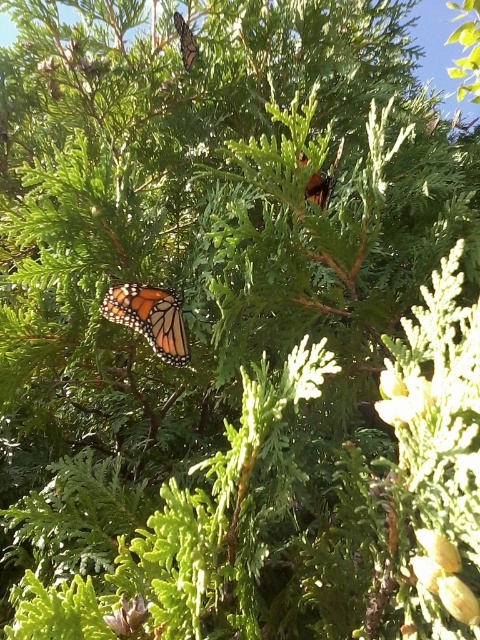
Question: Does orange and black spotted butterfly at center appear under orange and black spotted butterfly at upper center?

Choices:
 (A) yes
 (B) no

Answer: (A)

Question: Is orange and black spotted butterfly at center wider than orange and black spotted butterfly at upper center?

Choices:
 (A) no
 (B) yes

Answer: (B)

Question: From the image, what is the correct spatial relationship of orange and black spotted butterfly at center in relation to orange and black spotted butterfly at upper center?

Choices:
 (A) left
 (B) right

Answer: (A)

Question: Which object appears farthest from the camera in this image?

Choices:
 (A) orange and black spotted butterfly at upper center
 (B) orange and black spotted butterfly at center

Answer: (A)

Question: Which point appears farthest from the camera in this image?

Choices:
 (A) (126, 304)
 (B) (186, 58)

Answer: (B)